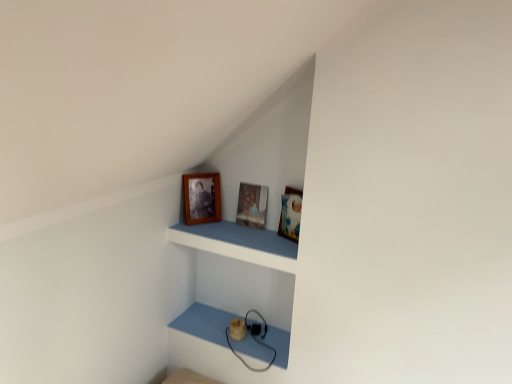
Where is `unoccupied region to the right of wooden photo frame at upper center, placed as the 1th picture frame when sorted from left to right`? This screenshot has width=512, height=384. unoccupied region to the right of wooden photo frame at upper center, placed as the 1th picture frame when sorted from left to right is located at coordinates [233, 231].